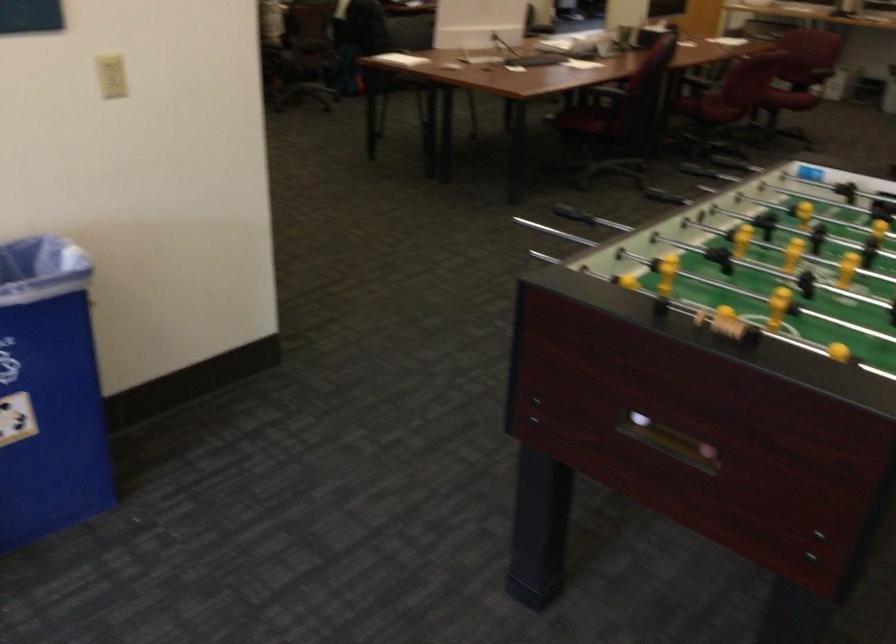
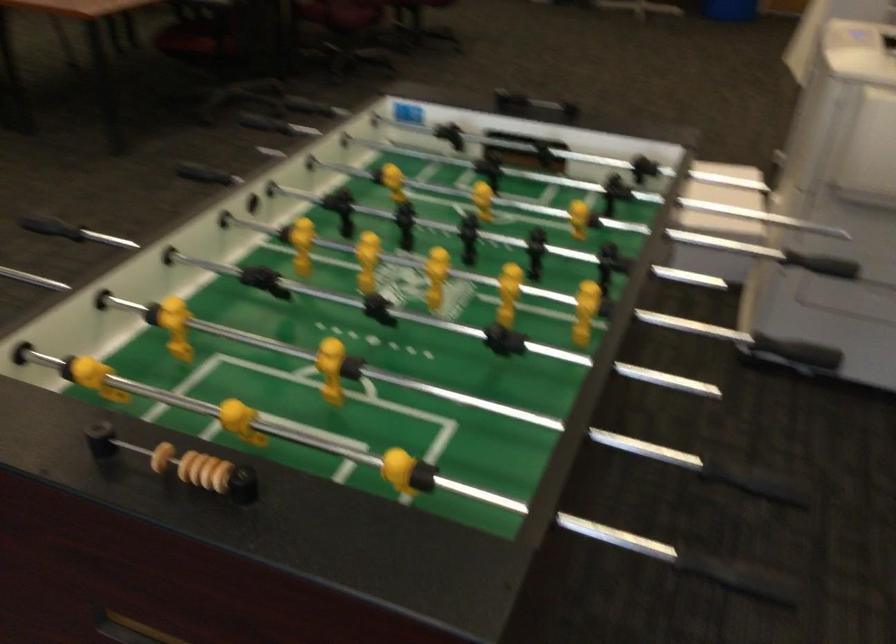
In the second image, find the point that corresponds to point (741, 326) in the first image.

(220, 476)